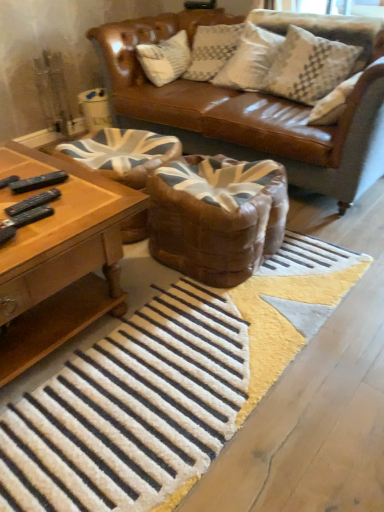
Question: Can you confirm if white textured pillow at upper right is positioned to the right of brown leather swivel chair at center, the second swivel chair in the left-to-right sequence?

Choices:
 (A) no
 (B) yes

Answer: (B)

Question: From a real-world perspective, is white textured pillow at upper right physically above brown leather swivel chair at center, which ranks as the 1th swivel chair in right-to-left order?

Choices:
 (A) yes
 (B) no

Answer: (A)

Question: Considering the relative sizes of white textured pillow at upper right and brown leather swivel chair at center, the second swivel chair in the left-to-right sequence, in the image provided, is white textured pillow at upper right thinner than brown leather swivel chair at center, the second swivel chair in the left-to-right sequence,?

Choices:
 (A) yes
 (B) no

Answer: (A)

Question: Is white textured pillow at upper right positioned behind brown leather swivel chair at center, which ranks as the 1th swivel chair in right-to-left order?

Choices:
 (A) no
 (B) yes

Answer: (B)

Question: Is white textured pillow at upper right facing towards brown leather swivel chair at center, the second swivel chair in the left-to-right sequence?

Choices:
 (A) no
 (B) yes

Answer: (B)

Question: From the image's perspective, is brown leather swivel chair at center, which ranks as the 1th swivel chair in right-to-left order, located above or below woodenobject at left?

Choices:
 (A) above
 (B) below

Answer: (A)

Question: In terms of height, does brown leather swivel chair at center, the second swivel chair in the left-to-right sequence, look taller or shorter compared to woodenobject at left?

Choices:
 (A) tall
 (B) short

Answer: (B)

Question: Do you think brown leather swivel chair at center, which ranks as the 1th swivel chair in right-to-left order, is within woodenobject at left, or outside of it?

Choices:
 (A) outside
 (B) inside

Answer: (A)

Question: Considering the positions of brown leather swivel chair at center, the second swivel chair in the left-to-right sequence, and woodenobject at left in the image, is brown leather swivel chair at center, the second swivel chair in the left-to-right sequence, wider or thinner than woodenobject at left?

Choices:
 (A) thin
 (B) wide

Answer: (A)

Question: From the image's perspective, is woodenobject at left positioned above or below white textured pillow at upper right?

Choices:
 (A) below
 (B) above

Answer: (A)

Question: In terms of width, does woodenobject at left look wider or thinner when compared to white textured pillow at upper right?

Choices:
 (A) wide
 (B) thin

Answer: (A)

Question: Looking at the image, does woodenobject at left seem bigger or smaller compared to white textured pillow at upper right?

Choices:
 (A) small
 (B) big

Answer: (B)

Question: Choose the correct answer: Is woodenobject at left inside white textured pillow at upper right or outside it?

Choices:
 (A) outside
 (B) inside

Answer: (A)

Question: Looking at their shapes, would you say white textured pillow at upper right is wider or thinner than woodenobject at left?

Choices:
 (A) thin
 (B) wide

Answer: (A)

Question: Considering their positions, is white textured pillow at upper right located in front of or behind woodenobject at left?

Choices:
 (A) behind
 (B) front

Answer: (A)